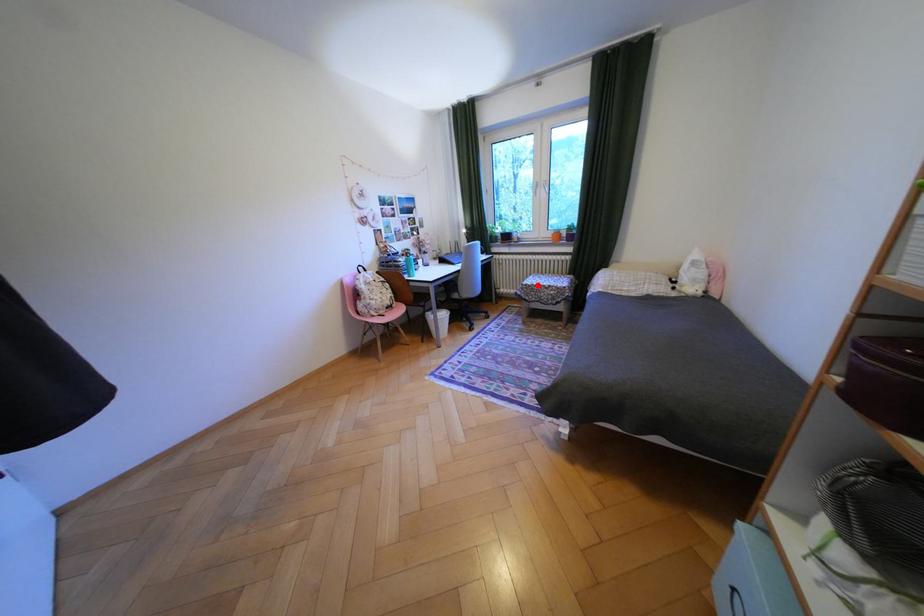
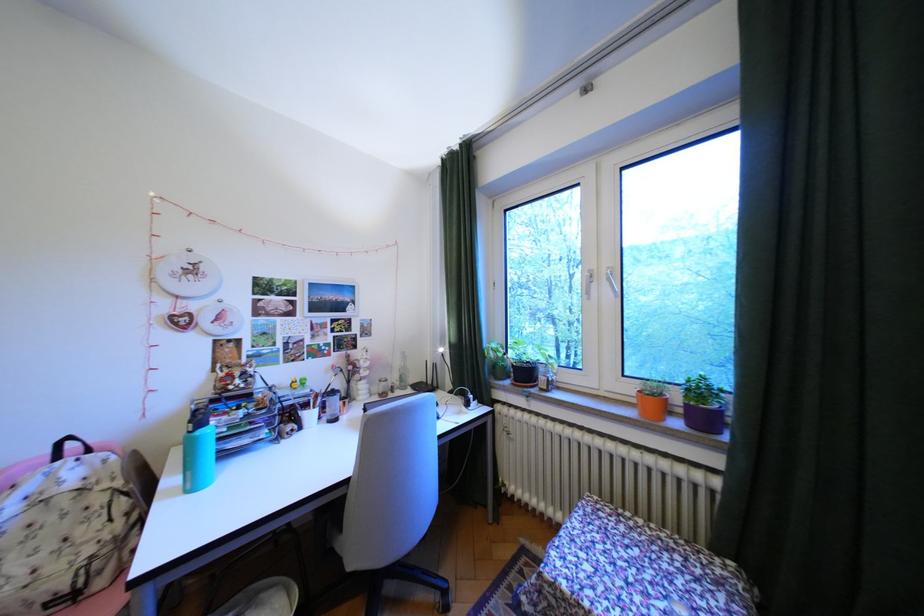
Question: I am providing you with two images of the same scene from different viewpoints. Image1 has a red point marked. In image2, the corresponding 3D location appears at what relative position? Reply with the corresponding letter.

Choices:
 (A) Closer
 (B) Farther

Answer: (B)